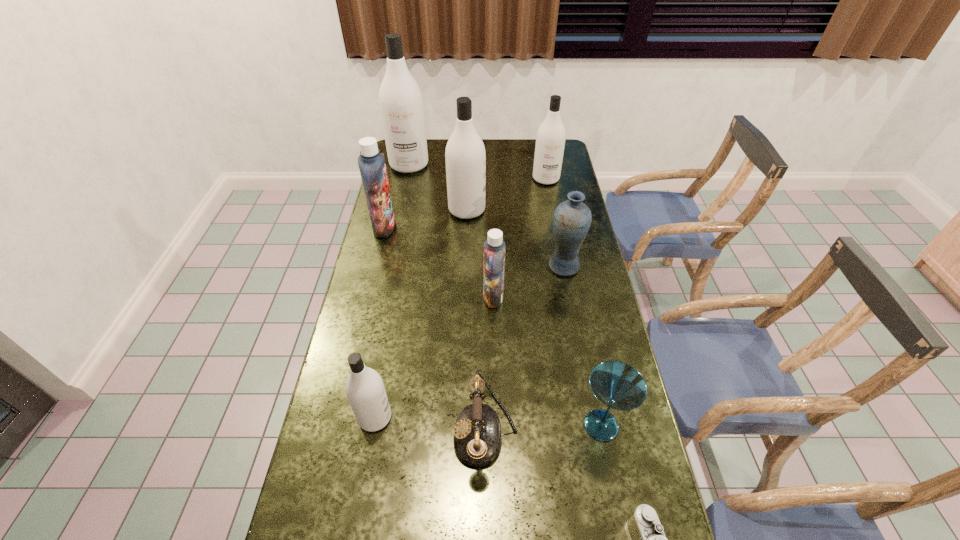
What are the coordinates of `the biggest white shampoo` in the screenshot? It's located at pyautogui.click(x=401, y=105).

Where is `the tallest object`? the tallest object is located at coordinates (401, 105).

Locate an element on the screen. The width and height of the screenshot is (960, 540). the ninth shortest object is located at coordinates [x=465, y=155].

This screenshot has width=960, height=540. In order to click on the fifth shortest shampoo in this screenshot , I will do tap(465, 155).

Identify the location of the left blue shampoo. The image size is (960, 540). (371, 163).

Where is `the bigger blue shampoo`? The width and height of the screenshot is (960, 540). the bigger blue shampoo is located at coordinates (371, 163).

Locate an element on the screen. This screenshot has width=960, height=540. the second smallest white shampoo is located at coordinates (550, 141).

You are a GUI agent. You are given a task and a screenshot of the screen. Output one action in this format:
    pyautogui.click(x=<x>, y=<y>)
    Task: Click on the rightmost white shampoo
    The width and height of the screenshot is (960, 540).
    Given the screenshot: What is the action you would take?
    pyautogui.click(x=550, y=141)

Where is `vase`? The height and width of the screenshot is (540, 960). vase is located at coordinates (571, 222).

At what (x,y) coordinates should I click in order to perform the action: click on the fifth farthest object. Please return your answer as a coordinate pair (x, y). This screenshot has width=960, height=540. Looking at the image, I should click on (571, 222).